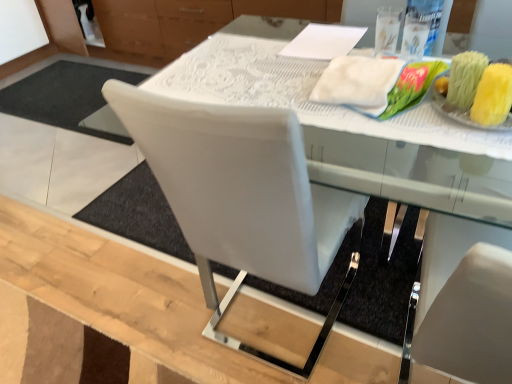
Question: Does white lace tablecloth at center have a larger size compared to white leather chair at center?

Choices:
 (A) no
 (B) yes

Answer: (A)

Question: Does white lace tablecloth at center have a lesser height compared to white leather chair at center?

Choices:
 (A) yes
 (B) no

Answer: (A)

Question: Is white leather chair at center a part of white lace tablecloth at center?

Choices:
 (A) no
 (B) yes

Answer: (A)

Question: Can you see white lace tablecloth at center touching white leather chair at center?

Choices:
 (A) no
 (B) yes

Answer: (A)

Question: Is white lace tablecloth at center outside of white leather chair at center?

Choices:
 (A) yes
 (B) no

Answer: (A)

Question: In the image, is white lace tablecloth at center positioned in front of or behind white fluffy cloth at upper right?

Choices:
 (A) front
 (B) behind

Answer: (A)

Question: Considering the positions of white lace tablecloth at center and white fluffy cloth at upper right in the image, is white lace tablecloth at center wider or thinner than white fluffy cloth at upper right?

Choices:
 (A) thin
 (B) wide

Answer: (B)

Question: From a real-world perspective, is white lace tablecloth at center physically located above or below white fluffy cloth at upper right?

Choices:
 (A) below
 (B) above

Answer: (A)

Question: Is white lace tablecloth at center taller or shorter than white fluffy cloth at upper right?

Choices:
 (A) short
 (B) tall

Answer: (A)

Question: In terms of width, does white fluffy cloth at upper right look wider or thinner when compared to white lace tablecloth at center?

Choices:
 (A) wide
 (B) thin

Answer: (B)

Question: Considering the positions of point (371, 109) and point (238, 29), is point (371, 109) closer or farther from the camera than point (238, 29)?

Choices:
 (A) closer
 (B) farther

Answer: (A)

Question: In terms of height, does white fluffy cloth at upper right look taller or shorter compared to white lace tablecloth at center?

Choices:
 (A) short
 (B) tall

Answer: (B)

Question: Is white fluffy cloth at upper right bigger or smaller than white lace tablecloth at center?

Choices:
 (A) big
 (B) small

Answer: (B)

Question: Is white leather chair at center spatially inside white fluffy cloth at upper right, or outside of it?

Choices:
 (A) outside
 (B) inside

Answer: (A)

Question: Considering the positions of white leather chair at center and white fluffy cloth at upper right in the image, is white leather chair at center wider or thinner than white fluffy cloth at upper right?

Choices:
 (A) wide
 (B) thin

Answer: (A)